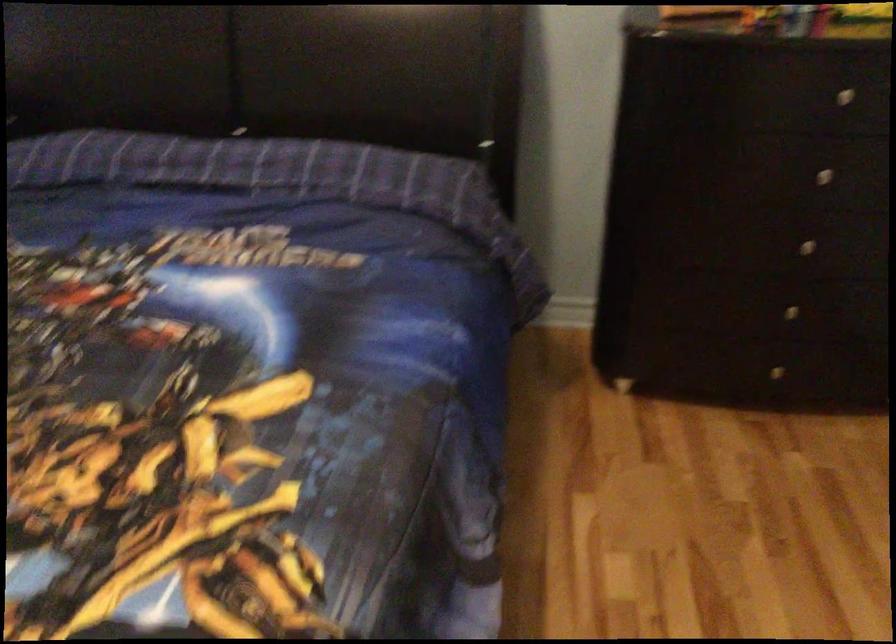
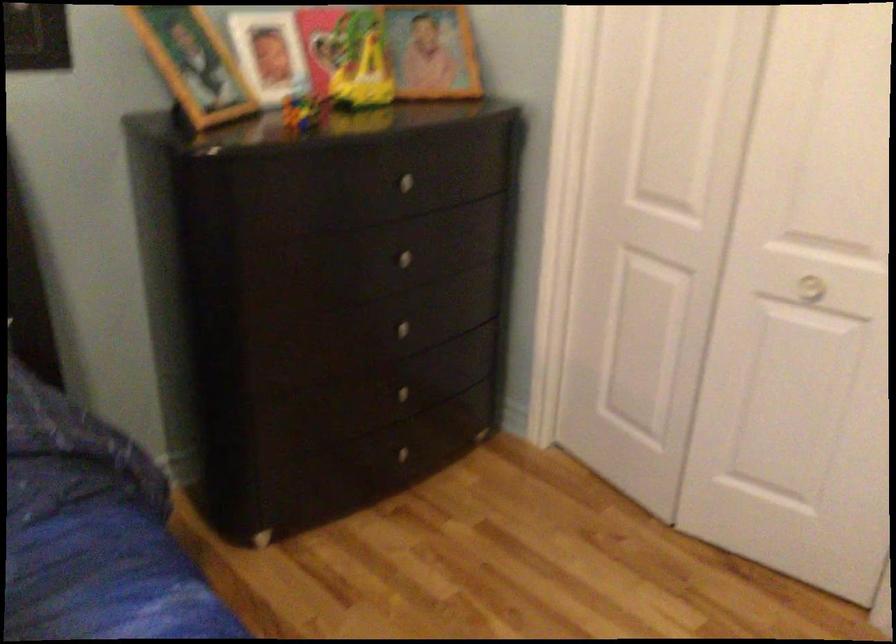
Find the pixel in the second image that matches [777,310] in the first image.

(400, 393)